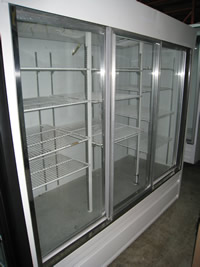
Locate an element on the screen. The image size is (200, 267). sliding glass doors on fridge is located at coordinates click(x=70, y=201), click(x=135, y=179), click(x=158, y=165).